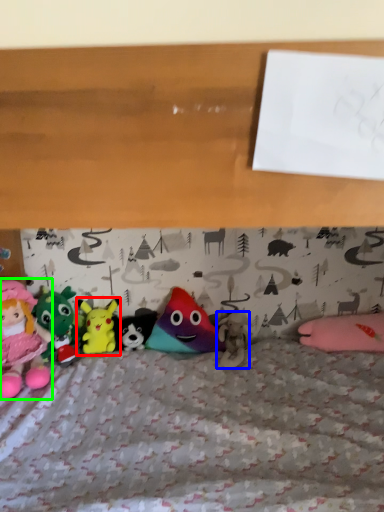
Question: Considering the real-world distances, which object is farthest from toy (highlighted by a red box)? toy (highlighted by a blue box) or toy (highlighted by a green box)?

Choices:
 (A) toy
 (B) toy

Answer: (A)